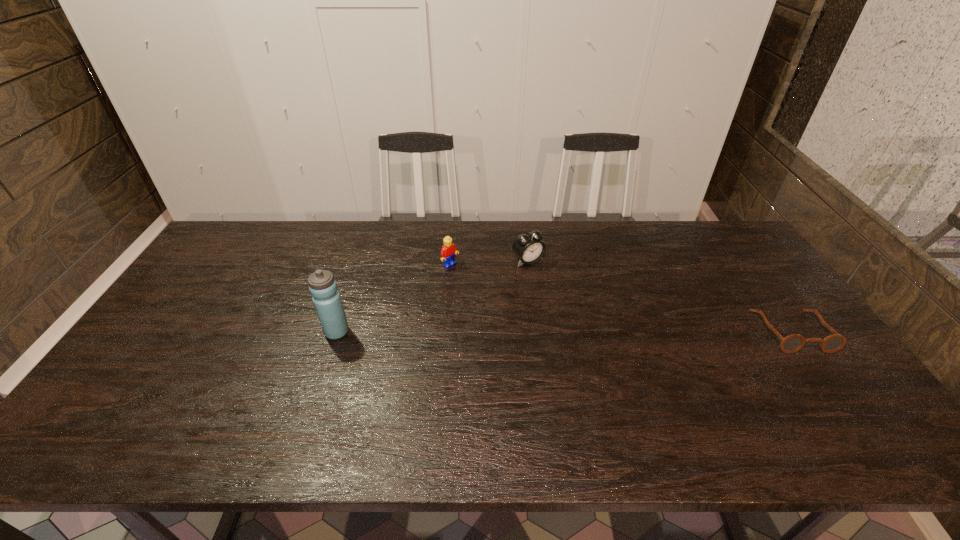
Identify the location of free space at the far left corner of the desktop. (259, 232).

The image size is (960, 540). I want to click on vacant space at the far right corner of the desktop, so click(731, 238).

This screenshot has width=960, height=540. I want to click on free space that is in between the water bottle and the spectacles, so click(564, 332).

Where is `free space that is in between the tallest object and the second object from left to right`? free space that is in between the tallest object and the second object from left to right is located at coordinates (394, 299).

Where is `empty location between the rightmost object and the Lego`? empty location between the rightmost object and the Lego is located at coordinates (621, 298).

Locate an element on the screen. The width and height of the screenshot is (960, 540). vacant space in between the shortest object and the alarm clock is located at coordinates (660, 296).

Locate an element on the screen. The height and width of the screenshot is (540, 960). unoccupied area between the Lego and the water bottle is located at coordinates (394, 299).

Where is `vacant area that lies between the water bottle and the spectacles`? This screenshot has width=960, height=540. vacant area that lies between the water bottle and the spectacles is located at coordinates (564, 332).

The height and width of the screenshot is (540, 960). Find the location of `blank region between the Lego and the tallest object`. blank region between the Lego and the tallest object is located at coordinates (394, 299).

Where is `vacant space that is in between the spectacles and the second object from right to left`? The width and height of the screenshot is (960, 540). vacant space that is in between the spectacles and the second object from right to left is located at coordinates (660, 296).